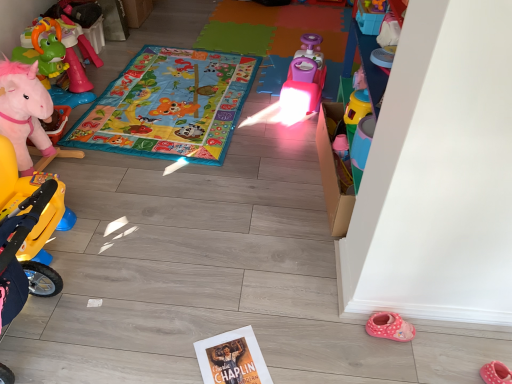
Question: Is pink plastic toy car at center, positioned as the 2th toy in left-to-right order, with multicolored fabric play mat at center?

Choices:
 (A) yes
 (B) no

Answer: (B)

Question: Considering the relative positions of pink plastic toy car at center, which is the 2th toy from right to left, and multicolored fabric play mat at center in the image provided, is pink plastic toy car at center, which is the 2th toy from right to left, to the left of multicolored fabric play mat at center from the viewer's perspective?

Choices:
 (A) yes
 (B) no

Answer: (B)

Question: Is pink plastic toy car at center, positioned as the 2th toy in left-to-right order, behind multicolored fabric play mat at center?

Choices:
 (A) yes
 (B) no

Answer: (A)

Question: Is pink plastic toy car at center, positioned as the 2th toy in left-to-right order, surrounding multicolored fabric play mat at center?

Choices:
 (A) yes
 (B) no

Answer: (B)

Question: Is pink plastic toy car at center, which is the second toy from front to back, bigger than multicolored fabric play mat at center?

Choices:
 (A) yes
 (B) no

Answer: (B)

Question: Can you confirm if pink plastic toy car at center, which is the second toy from front to back, is wider than multicolored fabric play mat at center?

Choices:
 (A) yes
 (B) no

Answer: (B)

Question: Is pink plush unicorn at left, the 1th toy viewed from the back, bigger than pink fabric slipper at lower right?

Choices:
 (A) no
 (B) yes

Answer: (B)

Question: Is pink plush unicorn at left, placed as the third toy when sorted from right to left, oriented towards pink fabric slipper at lower right?

Choices:
 (A) yes
 (B) no

Answer: (B)

Question: From a real-world perspective, does pink plush unicorn at left, the third toy when ordered from front to back, sit lower than pink fabric slipper at lower right?

Choices:
 (A) no
 (B) yes

Answer: (A)

Question: Can you confirm if pink plush unicorn at left, which ranks as the 1th toy in left-to-right order, is smaller than pink fabric slipper at lower right?

Choices:
 (A) no
 (B) yes

Answer: (A)

Question: Is pink plush unicorn at left, placed as the third toy when sorted from right to left, thinner than pink fabric slipper at lower right?

Choices:
 (A) no
 (B) yes

Answer: (A)

Question: Is pink fabric slipper at lower right located within pink plush unicorn at left, which ranks as the 1th toy in left-to-right order?

Choices:
 (A) no
 (B) yes

Answer: (A)

Question: Could translucent plastic cup at center-right, marked as the third toy in a back-to-front arrangement, be considered to be inside pink plush unicorn at left, the 1th toy viewed from the back?

Choices:
 (A) no
 (B) yes

Answer: (A)